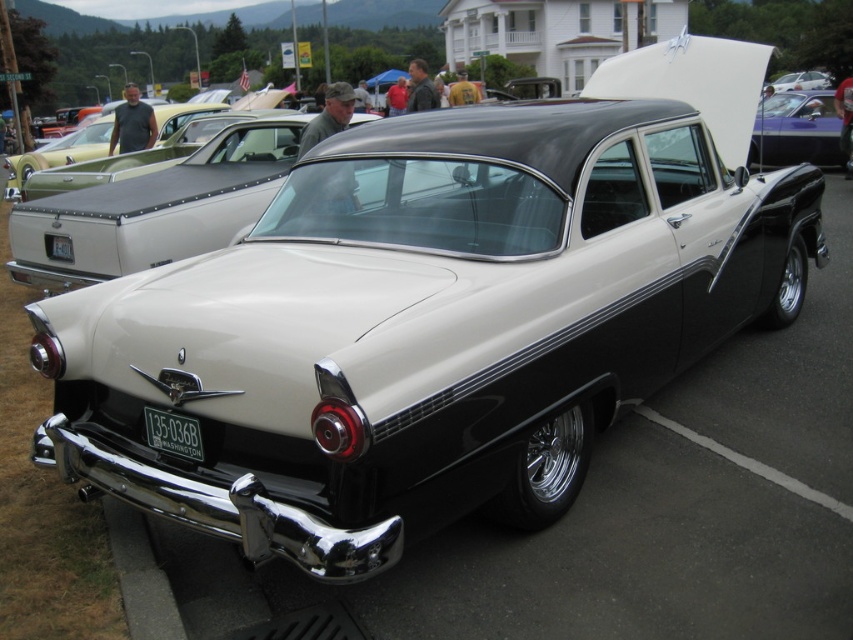
You are a photographer at a car show and want to capture both the purple glossy car at upper right and the green metallic license plate at rear in the same frame. Which object should you position closer to the center of your camera viewfinder to ensure both are visible?

The purple glossy car at upper right is positioned on the right side of green metallic license plate at rear. To include both in the frame, position the green metallic license plate at rear closer to the center of the camera viewfinder so that the purple glossy car at upper right can be accommodated on its right side.

You are a photographer at the car exhibition and want to take a photo of the purple glossy car at upper right and the black metallic license plate at lower center. Which object is positioned to the right side of the other?

The purple glossy car at upper right is positioned to the right of the black metallic license plate at lower center.

You are standing at the entrance of the car exhibition and want to take a photo of the point labeled as point (x=152, y=417) on the car. If your camera has a maximum focus range of 10 feet, will you be able to focus on that point?

The point (x=152, y=417) is 10.06 feet away from the viewer. Since the camera has a maximum focus range of 10 feet, the point is slightly beyond the camera can focus. Therefore, you won be able to focus on that point.